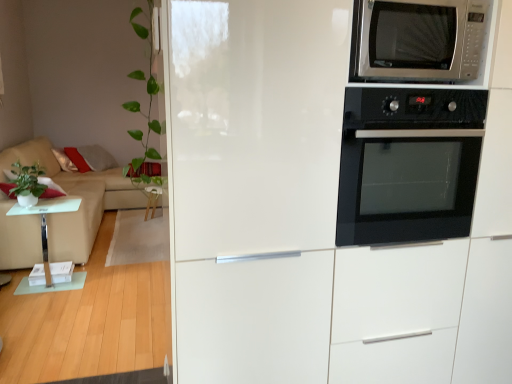
Question: In terms of width, does white glossy fridge at upper right look wider or thinner when compared to green leafy plant at left, which ranks as the 1th plant in right-to-left order?

Choices:
 (A) wide
 (B) thin

Answer: (A)

Question: From the image's perspective, relative to green leafy plant at left, which is counted as the 2th plant, starting from the back, is white glossy fridge at upper right above or below?

Choices:
 (A) above
 (B) below

Answer: (B)

Question: Estimate the real-world distances between objects in this image. Which object is closer to the green leafy plant at left, which appears as the second plant when viewed from the left?

Choices:
 (A) beige fabric couch at left
 (B) green matte plant at left, which is the 2th plant from right to left
 (C) transparent glass table at left
 (D) black glass oven at upper right
 (E) white glossy fridge at upper right

Answer: (E)

Question: Which of these objects is positioned closest to the green leafy plant at left, which ranks as the first plant in front-to-back order?

Choices:
 (A) satin silver microwave at upper right
 (B) green matte plant at left, positioned as the first plant in back-to-front order
 (C) transparent glass table at left
 (D) beige fabric couch at left
 (E) black glass oven at upper right

Answer: (A)